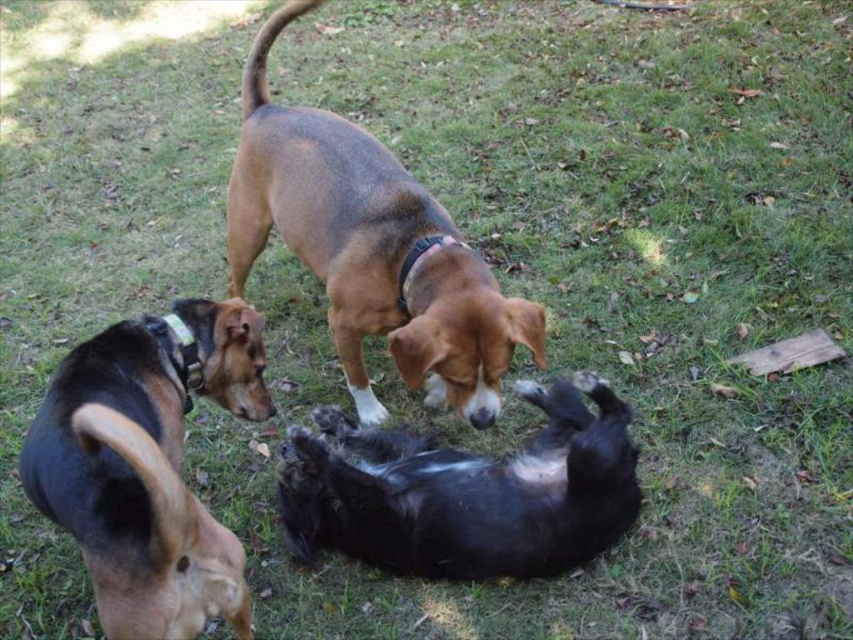
Question: Which point is closer to the camera?

Choices:
 (A) brown fur dog at lower left
 (B) black fur dog at center
 (C) brown matte dog at center

Answer: (A)

Question: Which object is positioned farthest from the black fur dog at center?

Choices:
 (A) brown fur dog at lower left
 (B) brown matte dog at center

Answer: (A)

Question: Is brown matte dog at center positioned behind black fur dog at center?

Choices:
 (A) no
 (B) yes

Answer: (B)

Question: Can you confirm if brown fur dog at lower left is positioned to the right of black fur dog at center?

Choices:
 (A) yes
 (B) no

Answer: (B)

Question: Is brown fur dog at lower left smaller than black fur dog at center?

Choices:
 (A) yes
 (B) no

Answer: (A)

Question: Which object is the closest to the brown matte dog at center?

Choices:
 (A) black fur dog at center
 (B) brown fur dog at lower left

Answer: (A)